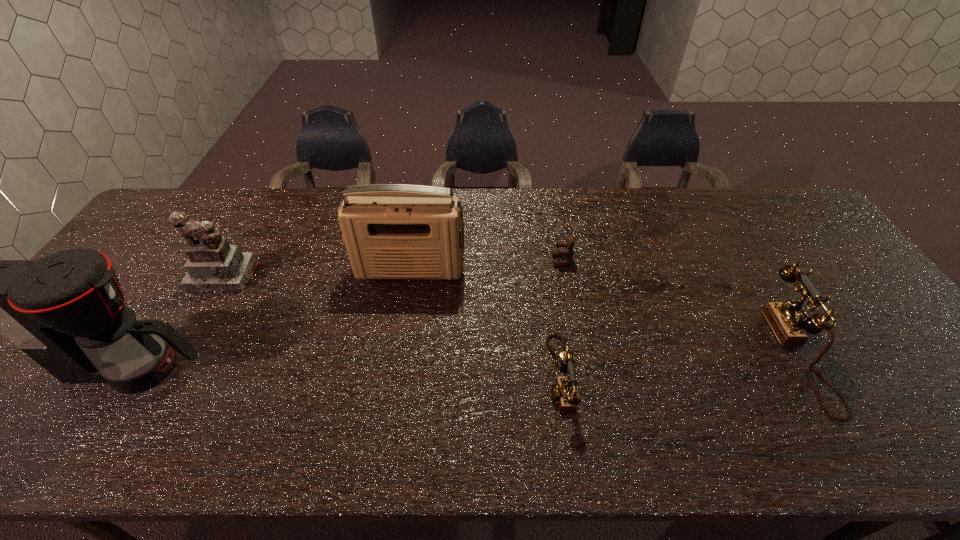
What are the coordinates of `free space located 0.220m on the front-facing side of the shorter telephone` in the screenshot? It's located at (456, 376).

I want to click on blank space located on the front-facing side of the shorter telephone, so click(x=468, y=376).

Where is `vacant space situated on the front-facing side of the third shortest object`? Image resolution: width=960 pixels, height=540 pixels. vacant space situated on the front-facing side of the third shortest object is located at coordinates (865, 354).

Find the location of a particular element. free space located 0.220m on the front-facing side of the third tallest object is located at coordinates (178, 359).

Identify the location of vacant space located on the face of the teddy bear. (443, 261).

The image size is (960, 540). Find the location of `vacant space located on the face of the teddy bear`. vacant space located on the face of the teddy bear is located at coordinates (486, 261).

In order to click on vacant space located on the face of the teddy bear in this screenshot , I will do pyautogui.click(x=432, y=261).

Locate an element on the screen. The height and width of the screenshot is (540, 960). vacant region located 0.110m pour from the carafe of the coffee maker is located at coordinates (251, 367).

Identify the location of vacant space located on the front-facing side of the radio receiver. (403, 310).

Identify the location of coffee maker that is at the near edge. This screenshot has width=960, height=540. (66, 311).